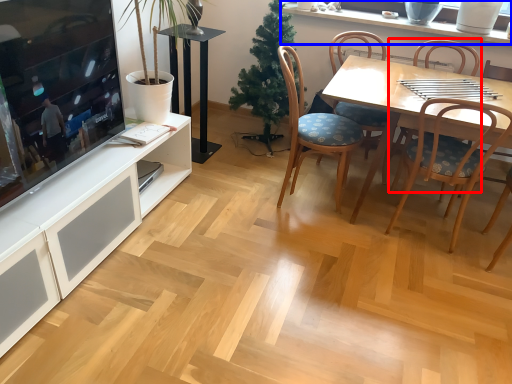
Question: Which object appears farthest to the camera in this image, chair (highlighted by a red box) or window sill (highlighted by a blue box)?

Choices:
 (A) chair
 (B) window sill

Answer: (B)